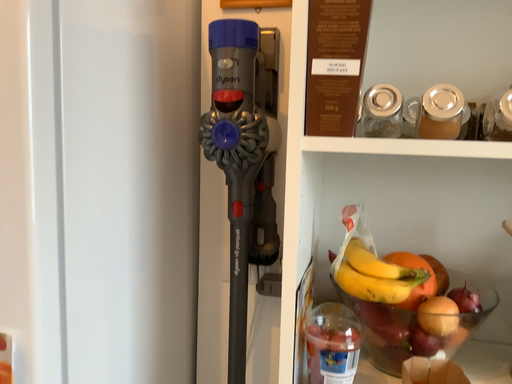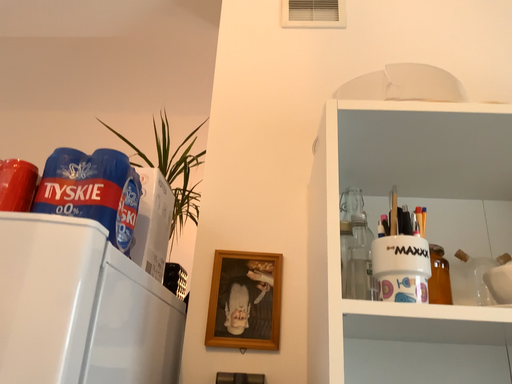
Question: How did the camera likely rotate when shooting the video?

Choices:
 (A) rotated upward
 (B) rotated downward

Answer: (A)